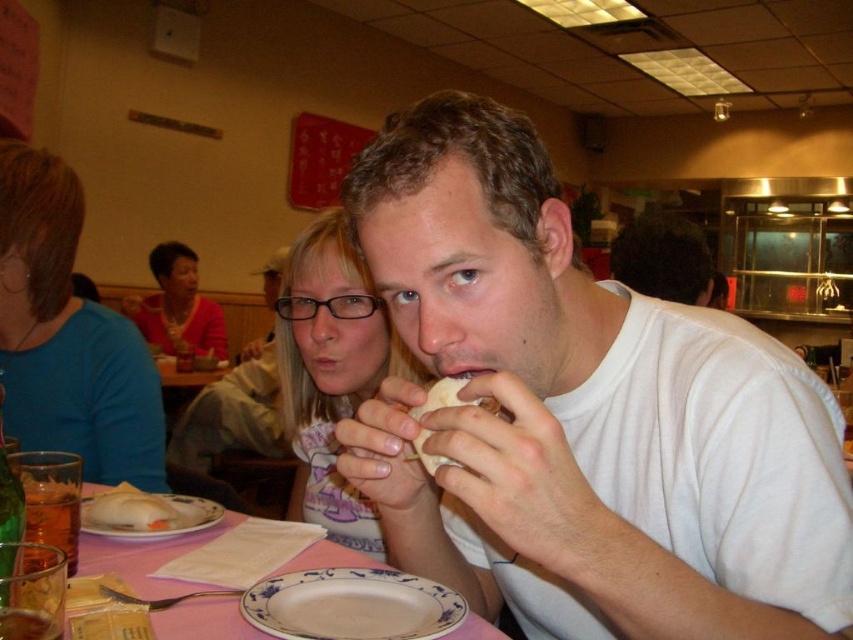
Is white matte shirt at center bigger than pink paper napkin at lower center?

Answer: Indeed, white matte shirt at center has a larger size compared to pink paper napkin at lower center.

Between white matte shirt at center and pink paper napkin at lower center, which one is positioned lower?

pink paper napkin at lower center is lower down.

Locate an element on the screen. This screenshot has width=853, height=640. white matte shirt at center is located at coordinates (582, 413).

Does white matte plate at lower left have a greater width compared to white bread at center?

Yes.

Can you confirm if white matte plate at lower left is shorter than white bread at center?

Correct, white matte plate at lower left is not as tall as white bread at center.

Which is in front, point (111, 509) or point (454, 465)?

Point (454, 465) is more forward.

Locate an element on the screen. This screenshot has height=640, width=853. white matte plate at lower left is located at coordinates (144, 513).

Find the location of a particular element. blue fabric shirt at left is located at coordinates (67, 336).